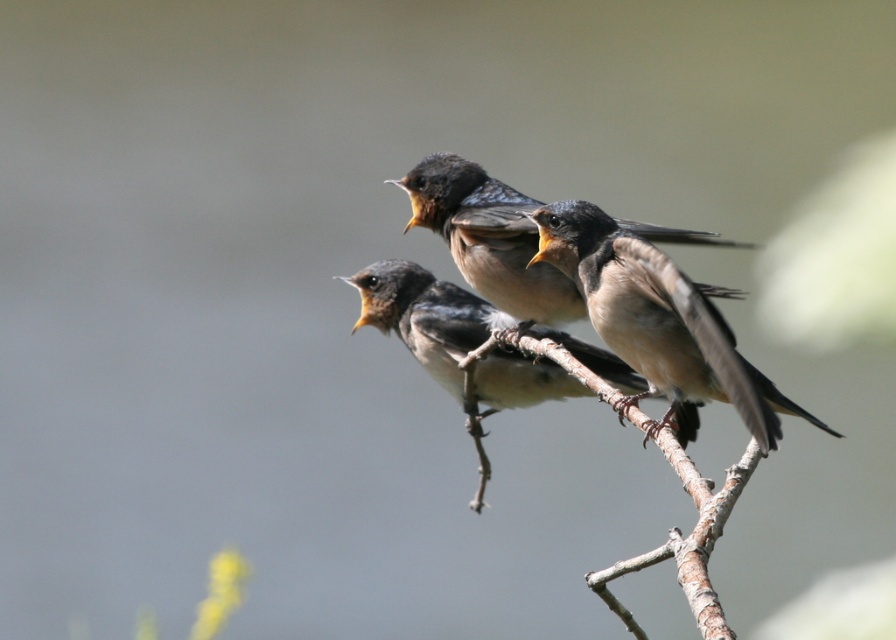
Question: Is brown feathered bird at center above brown rough tree branch at center?

Choices:
 (A) yes
 (B) no

Answer: (A)

Question: In this image, where is brown matte bird at center located relative to brown feathered birds at center?

Choices:
 (A) below
 (B) above

Answer: (A)

Question: Which object is positioned closest to the brown matte bird at center?

Choices:
 (A) brown feathered bird at center
 (B) brown feathered birds at center
 (C) brown rough tree branch at center

Answer: (C)

Question: Which object appears closest to the camera in this image?

Choices:
 (A) brown feathered birds at center
 (B) brown rough tree branch at center
 (C) brown feathered bird at center
 (D) brown matte bird at center

Answer: (B)

Question: Is brown matte bird at center closer to the viewer compared to brown feathered birds at center?

Choices:
 (A) yes
 (B) no

Answer: (B)

Question: Which object is closer to the camera taking this photo?

Choices:
 (A) brown feathered birds at center
 (B) brown matte bird at center
 (C) brown rough tree branch at center
 (D) brown feathered bird at center

Answer: (C)